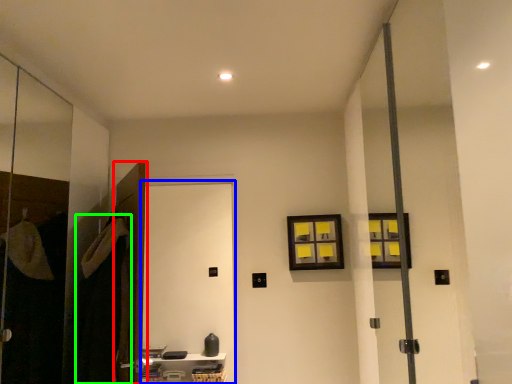
Question: Considering the real-world distances, which object is closest to door (highlighted by a red box)? screen door (highlighted by a blue box) or robe (highlighted by a green box).

Choices:
 (A) screen door
 (B) robe

Answer: (B)